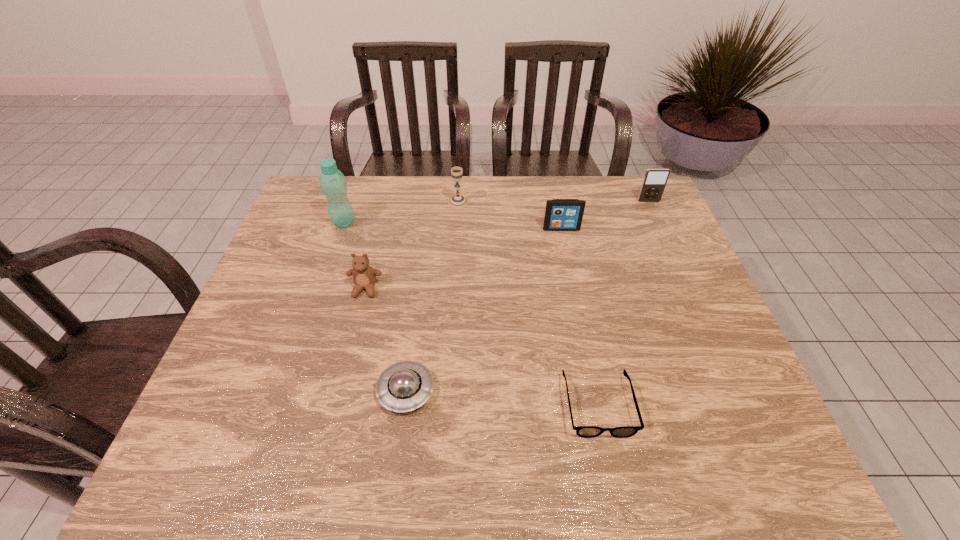
Locate an element on the screen. The width and height of the screenshot is (960, 540). free space located on the left of the leftmost object is located at coordinates (312, 222).

Find the location of a particular element. free region located on the right of the chalice is located at coordinates (585, 202).

You are a GUI agent. You are given a task and a screenshot of the screen. Output one action in this format:
    pyautogui.click(x=<x>, y=<y>)
    Task: Click on the vacant area situated on the front-facing side of the right iPod
    This screenshot has height=540, width=960.
    Given the screenshot: What is the action you would take?
    pyautogui.click(x=679, y=269)

The image size is (960, 540). In order to click on free location located 0.260m on the front-facing side of the sixth object from right to left in this screenshot , I will do `click(341, 389)`.

I want to click on free region located on the front screen of the nearer iPod, so click(574, 293).

The height and width of the screenshot is (540, 960). I want to click on free space located on the front of the saucer, so click(397, 456).

What are the coordinates of `vacant space situated 0.070m on the arms of the spectacles` in the screenshot? It's located at (612, 474).

Locate an element on the screen. This screenshot has width=960, height=540. bottle situated at the far edge is located at coordinates (333, 184).

This screenshot has height=540, width=960. In order to click on chalice present at the far edge in this screenshot , I will do `click(457, 201)`.

Where is `iPod at the far edge`? iPod at the far edge is located at coordinates (655, 180).